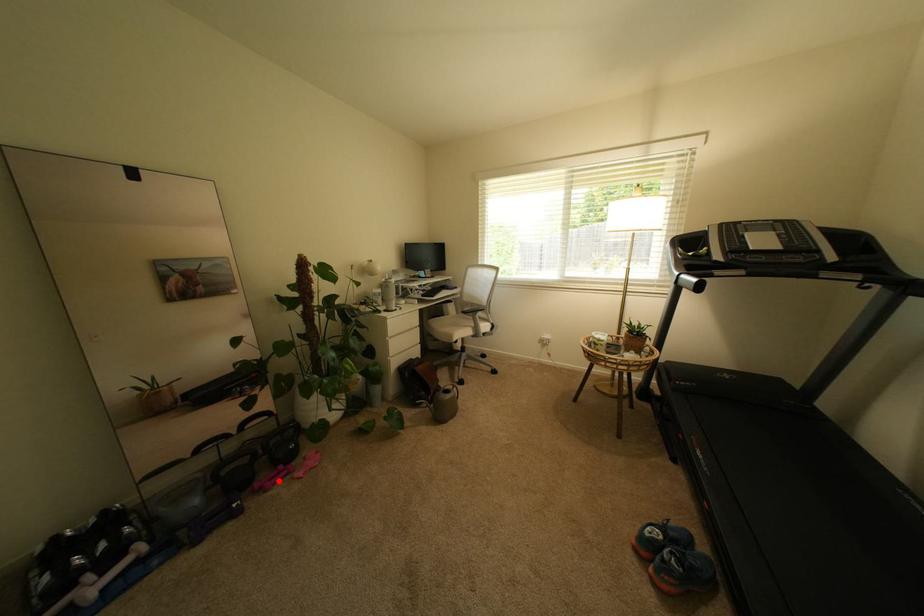
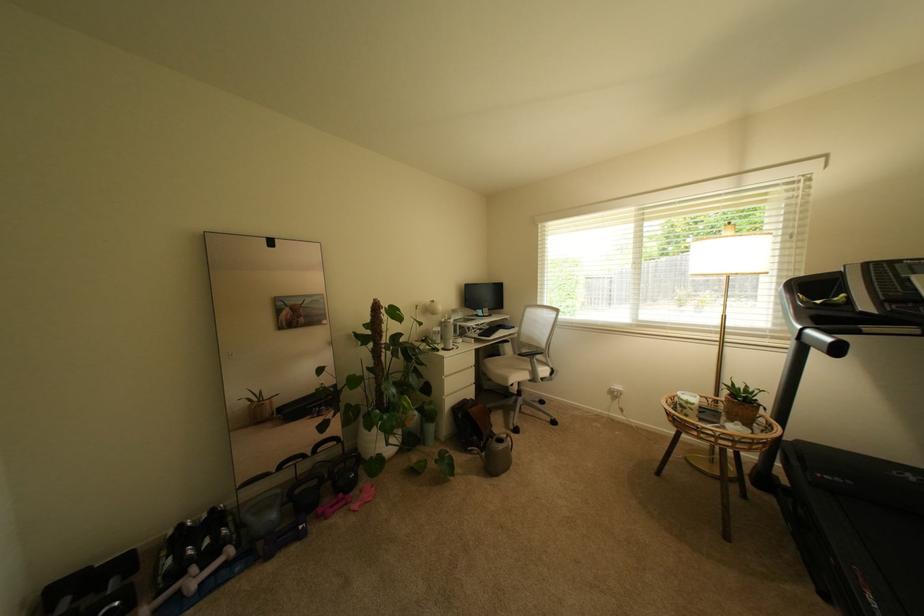
The point at the highlighted location is marked in the first image. Where is the corresponding point in the second image?

(339, 508)